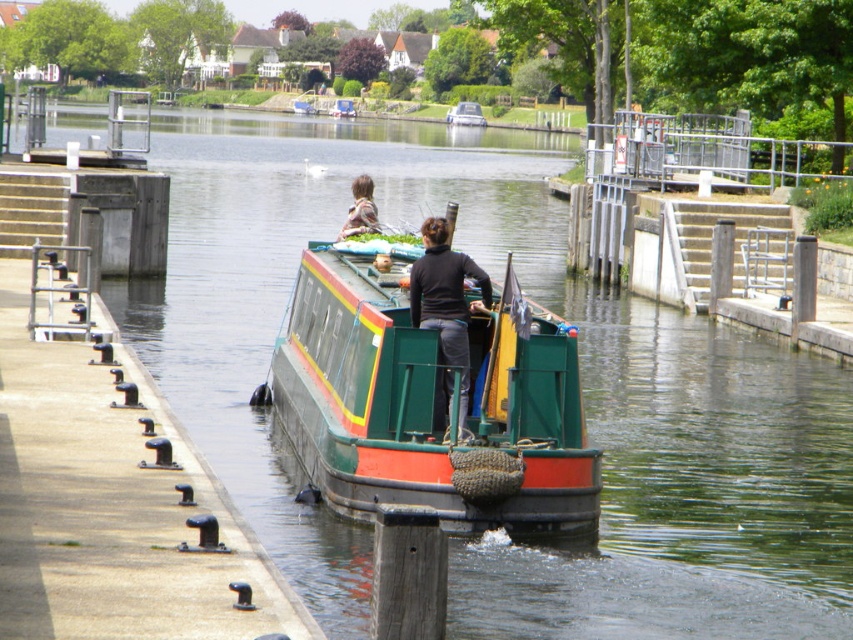
You are standing on the dock and see the green painted wood boat at center and the black matte jacket at center. Which object is closer to you?

The green painted wood boat at center is positioned under the black matte jacket at center, so the jacket is higher up and the boat is lower. Since you are on the dock, the boat is closer to you than the jacket.

You are a passenger on the canal boat and need to reach the black matte jacket at center. Based on your position at the stern, where should you walk to find it?

The black matte jacket at center is located at point 0.486 on the x axis and 0.523 on the y axis, so you should walk towards the middle of the boat from the stern to reach it.

You are a delivery person trying to fit a package into the space between the green painted wood boat at center and the camouflage jacket at upper center. The package is 1.2 meters wide. Can the package fit in the space between them?

The green painted wood boat at center is narrower than the camouflage jacket at upper center. However, the exact width of the space between them isn